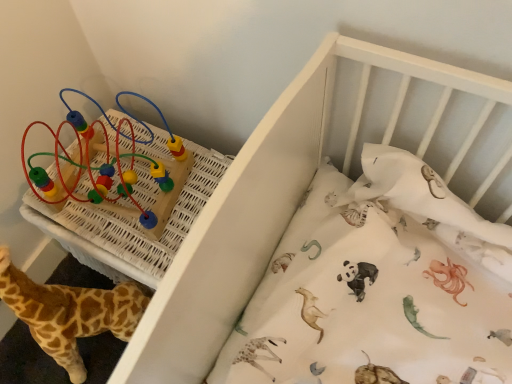
Looking at this image, what is the approximate height of multicolored plastic beads at upper left?

multicolored plastic beads at upper left is 11.06 inches tall.

Find the location of `multicolored plastic beads at upper left`. multicolored plastic beads at upper left is located at coordinates (120, 169).

Looking at this image, from a real-world perspective, does soft plush giraffe at lower left stand above multicolored plastic beads at upper left?

Actually, soft plush giraffe at lower left is physically below multicolored plastic beads at upper left in the real world.

From the image's perspective, is soft plush giraffe at lower left above or below multicolored plastic beads at upper left?

soft plush giraffe at lower left is situated lower than multicolored plastic beads at upper left in the image.

Between soft plush giraffe at lower left and multicolored plastic beads at upper left, which one has larger width?

With larger width is multicolored plastic beads at upper left.

At what (x,y) coordinates should I click in order to perform the action: click on toy that is on the right side of soft plush giraffe at lower left. Please return your answer as a coordinate pair (x, y). The width and height of the screenshot is (512, 384). Looking at the image, I should click on (120, 169).

From a real-world perspective, which object stands above the other?

multicolored plastic beads at upper left, from a real-world perspective.

Between multicolored plastic beads at upper left and white wooden crib at upper center, which one appears on the left side from the viewer's perspective?

multicolored plastic beads at upper left is more to the left.

From the image's perspective, between multicolored plastic beads at upper left and white wooden crib at upper center, who is located below?

white wooden crib at upper center.

Is white wooden crib at upper center completely or partially outside of soft plush giraffe at lower left?

That's correct, white wooden crib at upper center is outside of soft plush giraffe at lower left.

Which object is thinner, white wooden crib at upper center or soft plush giraffe at lower left?

With smaller width is soft plush giraffe at lower left.

Is point (257, 136) farther from viewer compared to point (20, 297)?

No, it is in front of (20, 297).

Is white wooden crib at upper center not close to soft plush giraffe at lower left?

No, white wooden crib at upper center is not far from soft plush giraffe at lower left.

Does multicolored plastic beads at upper left turn towards soft plush giraffe at lower left?

Yes, multicolored plastic beads at upper left is facing soft plush giraffe at lower left.

Can soft plush giraffe at lower left be found inside multicolored plastic beads at upper left?

That's incorrect, soft plush giraffe at lower left is not inside multicolored plastic beads at upper left.

Can you confirm if multicolored plastic beads at upper left is positioned to the left of soft plush giraffe at lower left?

In fact, multicolored plastic beads at upper left is to the right of soft plush giraffe at lower left.

Who is taller, multicolored plastic beads at upper left or soft plush giraffe at lower left?

Standing taller between the two is soft plush giraffe at lower left.

Which point is more forward, (96, 324) or (354, 131)?

The point (354, 131) is closer.

Is soft plush giraffe at lower left next to white wooden crib at upper center?

They are not placed beside each other.

Can you tell me how much soft plush giraffe at lower left and white wooden crib at upper center differ in facing direction?

There is a 34.7-degree angle between the facing directions of soft plush giraffe at lower left and white wooden crib at upper center.

Is soft plush giraffe at lower left to the right of white wooden crib at upper center from the viewer's perspective?

In fact, soft plush giraffe at lower left is to the left of white wooden crib at upper center.

Is white wooden crib at upper center at the right side of multicolored plastic beads at upper left?

Correct, you'll find white wooden crib at upper center to the right of multicolored plastic beads at upper left.

Is white wooden crib at upper center bigger than multicolored plastic beads at upper left?

Yes, white wooden crib at upper center is bigger than multicolored plastic beads at upper left.

Are white wooden crib at upper center and multicolored plastic beads at upper left beside each other?

There is a gap between white wooden crib at upper center and multicolored plastic beads at upper left.

From the picture: Is white wooden crib at upper center oriented away from multicolored plastic beads at upper left?

No, multicolored plastic beads at upper left is not at the back of white wooden crib at upper center.

Find the location of a particular element. toy that is above the soft plush giraffe at lower left (from the image's perspective) is located at coordinates (120, 169).

At what (x,y) coordinates should I click in order to perform the action: click on infant bed lying in front of the multicolored plastic beads at upper left. Please return your answer as a coordinate pair (x, y). The height and width of the screenshot is (384, 512). Looking at the image, I should click on (311, 179).

Looking at the image, which one is located closer to white wooden crib at upper center, soft plush giraffe at lower left or multicolored plastic beads at upper left?

multicolored plastic beads at upper left.

In the scene shown: From the image, which object appears to be farther from multicolored plastic beads at upper left, white wooden crib at upper center or soft plush giraffe at lower left?

The object further to multicolored plastic beads at upper left is white wooden crib at upper center.

Based on their spatial positions, is soft plush giraffe at lower left or white wooden crib at upper center closer to multicolored plastic beads at upper left?

Based on the image, soft plush giraffe at lower left appears to be nearer to multicolored plastic beads at upper left.

Which object lies further to the anchor point white wooden crib at upper center, multicolored plastic beads at upper left or soft plush giraffe at lower left?

soft plush giraffe at lower left.

When comparing their distances from soft plush giraffe at lower left, does white wooden crib at upper center or multicolored plastic beads at upper left seem further?

white wooden crib at upper center.

From the image, which object appears to be nearer to soft plush giraffe at lower left, multicolored plastic beads at upper left or white wooden crib at upper center?

multicolored plastic beads at upper left is positioned closer to the anchor soft plush giraffe at lower left.

This screenshot has width=512, height=384. I want to click on toy located between soft plush giraffe at lower left and white wooden crib at upper center in the left-right direction, so click(x=120, y=169).